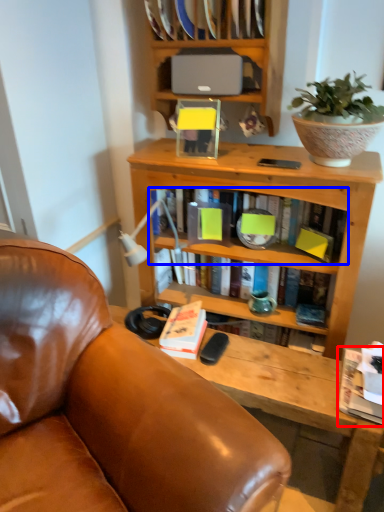
Question: Which point is further to the camera, book (highlighted by a red box) or book (highlighted by a blue box)?

Choices:
 (A) book
 (B) book

Answer: (B)